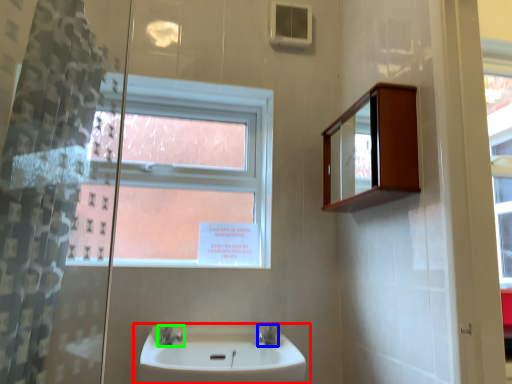
Question: Considering the real-world distances, which object is farthest from sink (highlighted by a red box)? tap (highlighted by a blue box) or tap (highlighted by a green box)?

Choices:
 (A) tap
 (B) tap

Answer: (A)